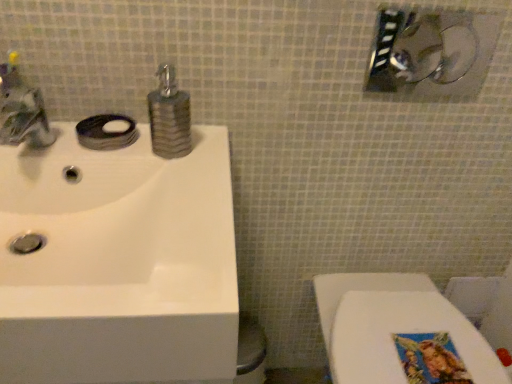
Question: In terms of width, does brushed metal faucet at upper left look wider or thinner when compared to textured brown soap dispenser at center?

Choices:
 (A) wide
 (B) thin

Answer: (A)

Question: From the image's perspective, is brushed metal faucet at upper left above or below textured brown soap dispenser at center?

Choices:
 (A) above
 (B) below

Answer: (B)

Question: Based on their relative distances, which object is farther from the brushed metal showerhead at upper right?

Choices:
 (A) white glossy sink at upper left
 (B) brushed metal faucet at upper left
 (C) white glossy toilet at lower right
 (D) textured brown soap dispenser at center
 (E) matte silver soap at sink left

Answer: (B)

Question: Based on their relative distances, which object is nearer to the matte silver soap at sink left?

Choices:
 (A) textured brown soap dispenser at center
 (B) brushed metal faucet at upper left
 (C) white glossy toilet at lower right
 (D) brushed metal showerhead at upper right
 (E) white glossy sink at upper left

Answer: (A)